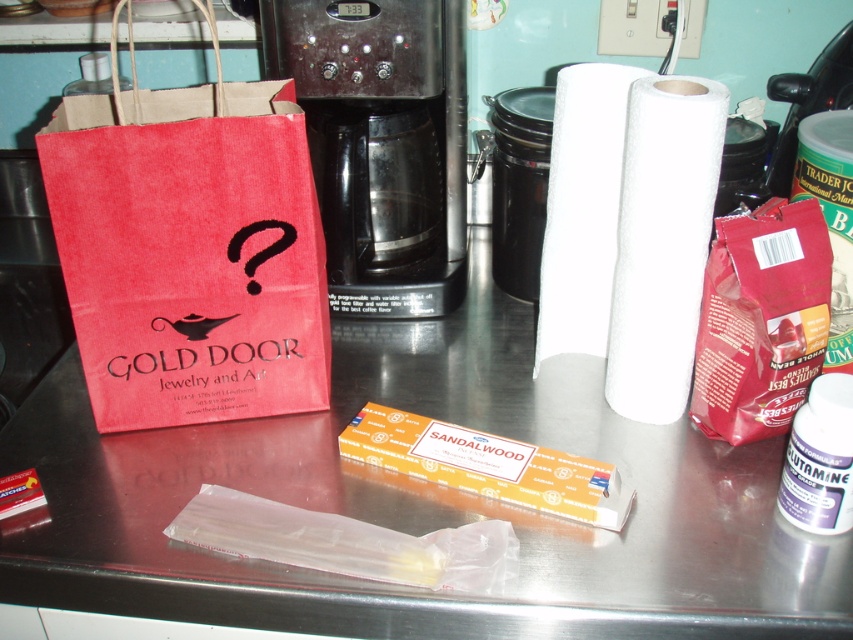
You are organizing items on the kitchen countertop. You need to place a new coffee mug between the matte paper bag at left and the black plastic coffee machine at center. Where should you place the mug to ensure it is between them?

The matte paper bag at left is positioned on the left side of the black plastic coffee machine at center, so placing the coffee mug between them would require placing it to the right of the matte paper bag at left and to the left of the black plastic coffee machine at center.

You are standing in front of the kitchen countertop. You want to place a small vase that is 12 inches tall on the countertop. Can you determine if the point at coordinate (x=775, y=497) is far enough from the edge to safely place the vase without it falling off?

The distance of point (x=775, y=497) from viewer is 28.72 inches, so yes, the point is far enough from the edge to safely place the vase since it is more than 12 inches away.